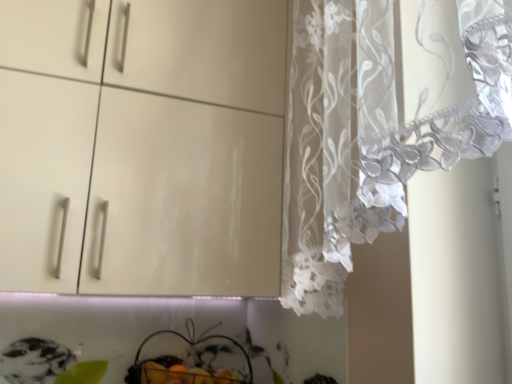
Locate an element on the screen. The height and width of the screenshot is (384, 512). metallic wire basket at lower center is located at coordinates (190, 359).

The image size is (512, 384). What do you see at coordinates (190, 359) in the screenshot? I see `metallic wire basket at lower center` at bounding box center [190, 359].

Locate an element on the screen. metallic wire basket at lower center is located at coordinates (190, 359).